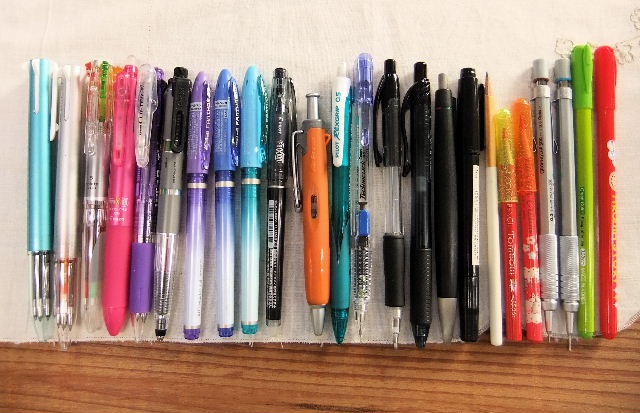
You are a GUI agent. You are given a task and a screenshot of the screen. Output one action in this format:
    pyautogui.click(x=<x>, y=<y>)
    Task: Click on the black pens
    This screenshot has height=413, width=640.
    Given the screenshot: What is the action you would take?
    pyautogui.click(x=463, y=97), pyautogui.click(x=444, y=114), pyautogui.click(x=424, y=104), pyautogui.click(x=390, y=97), pyautogui.click(x=283, y=97), pyautogui.click(x=185, y=109)